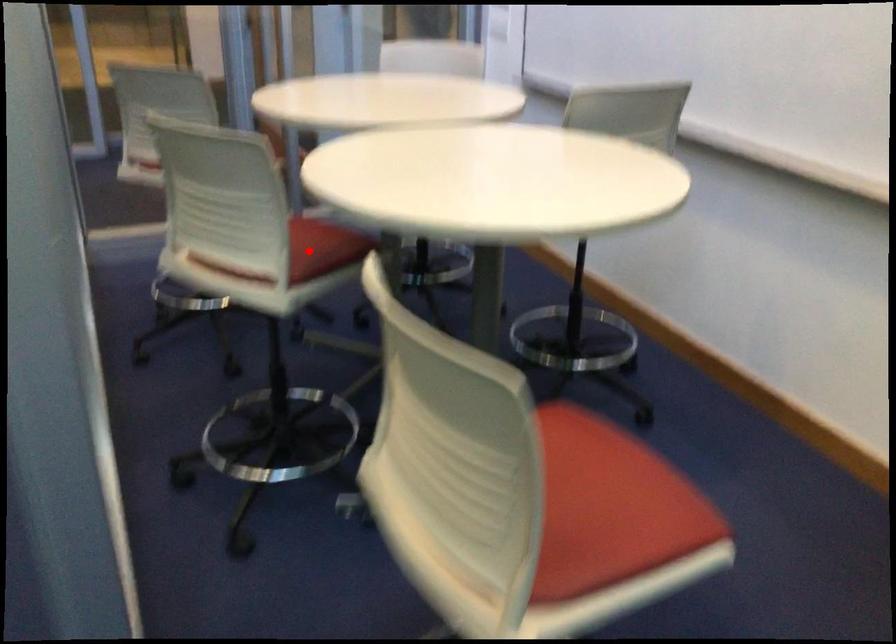
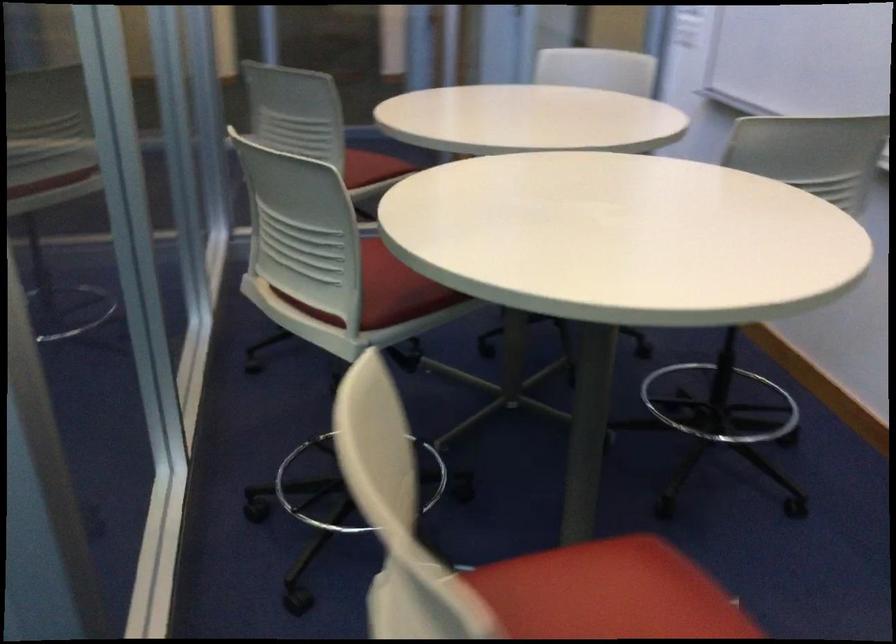
In the second image, find the point that corresponds to the highlighted location in the first image.

(397, 289)